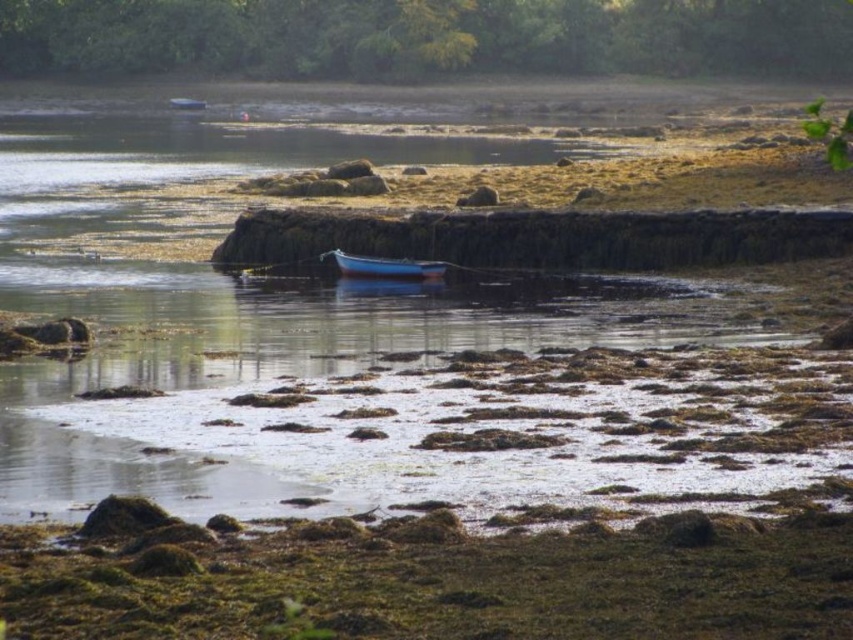
Who is lower down, blue polished wood boat at center or blue glossy boat at upper center?

blue polished wood boat at center is lower down.

Does blue polished wood boat at center have a lesser width compared to blue glossy boat at upper center?

Incorrect, blue polished wood boat at center's width is not less than blue glossy boat at upper center's.

Locate an element on the screen. The height and width of the screenshot is (640, 853). blue polished wood boat at center is located at coordinates (384, 266).